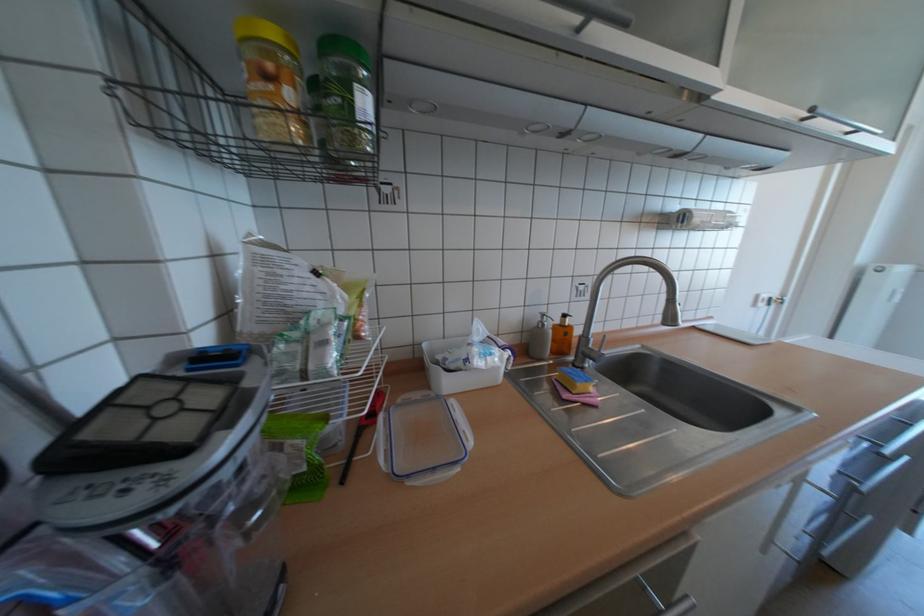
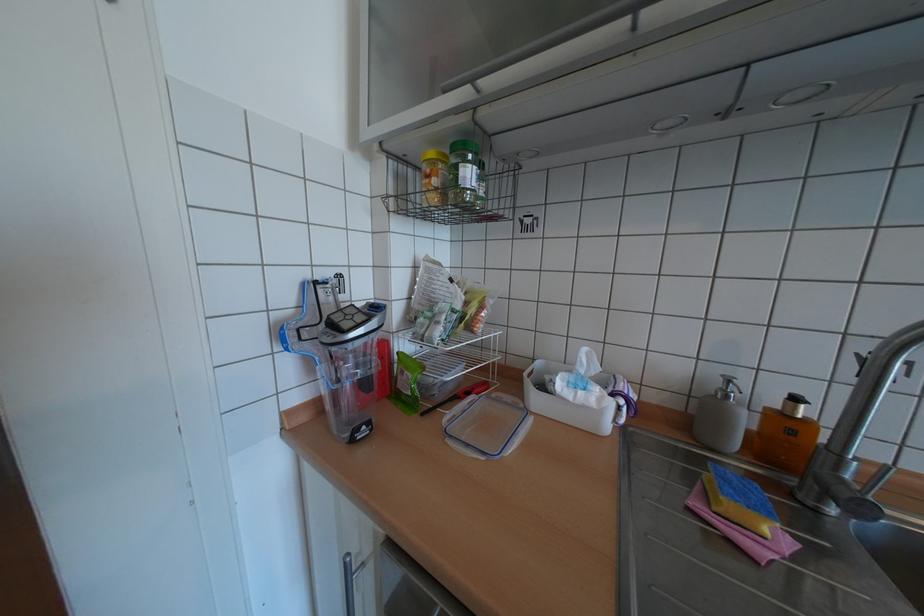
Locate, in the second image, the point that corresponds to [391,410] in the first image.

(487, 394)